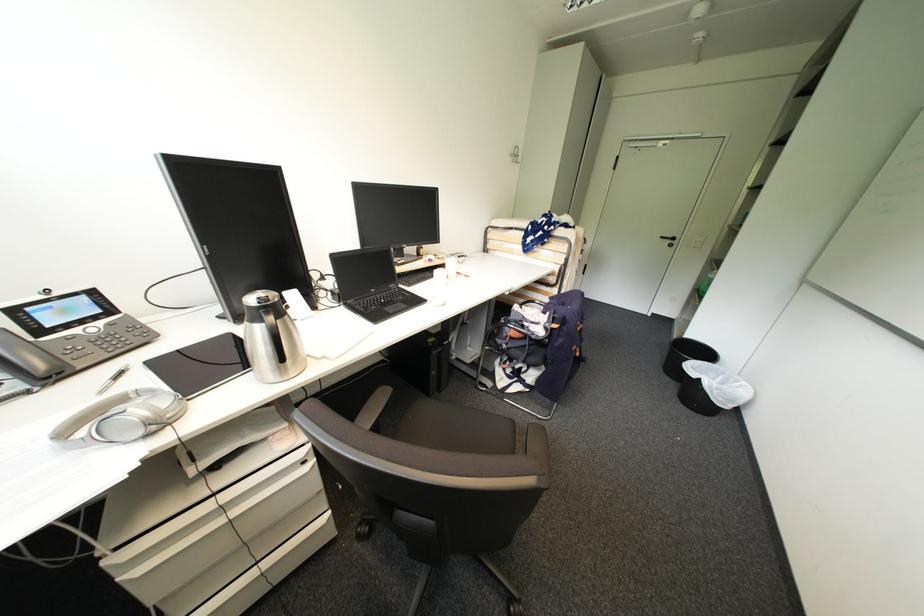
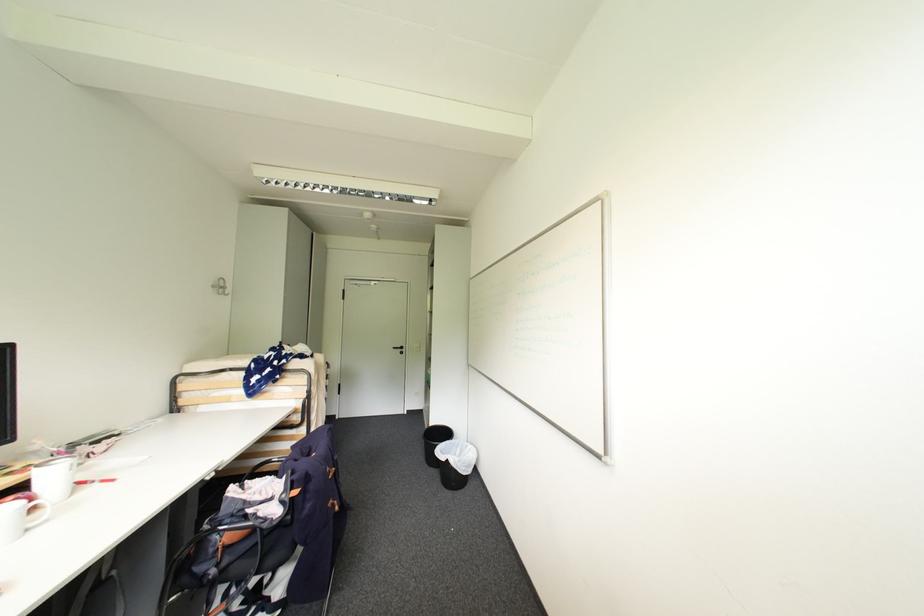
Where in the second image is the point corresponding to the point at 714,363 from the first image?

(456, 442)